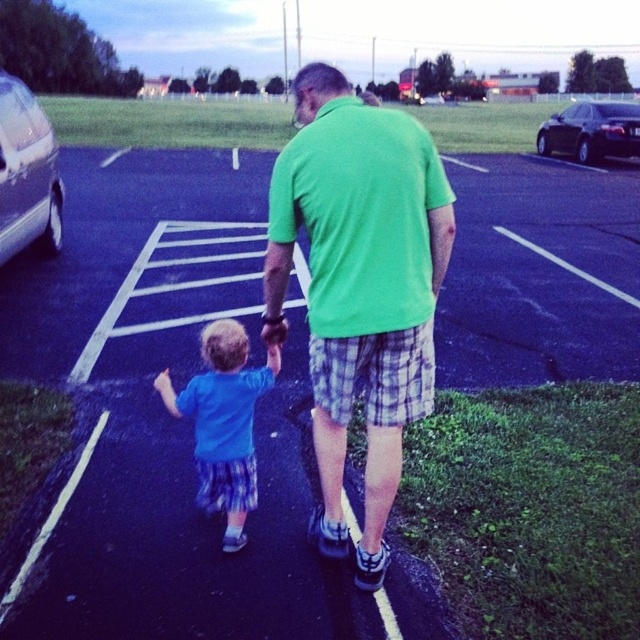
Does green fabric shirt at center have a smaller size compared to shiny black sedan at upper right?

Yes.

Is green fabric shirt at center to the right of shiny black sedan at upper right from the viewer's perspective?

Incorrect, green fabric shirt at center is not on the right side of shiny black sedan at upper right.

Between point (381, 428) and point (572, 154), which one is positioned in front?

Positioned in front is point (381, 428).

At what (x,y) coordinates should I click in order to perform the action: click on green fabric shirt at center. Please return your answer as a coordinate pair (x, y). The height and width of the screenshot is (640, 640). Looking at the image, I should click on (358, 285).

Does green fabric shirt at center appear on the right side of silver metallic car at left?

Correct, you'll find green fabric shirt at center to the right of silver metallic car at left.

Is green fabric shirt at center above silver metallic car at left?

Actually, green fabric shirt at center is below silver metallic car at left.

Is point (426, 170) closer to viewer compared to point (33, 225)?

Yes, it is.

At what (x,y) coordinates should I click in order to perform the action: click on green fabric shirt at center. Please return your answer as a coordinate pair (x, y). Image resolution: width=640 pixels, height=640 pixels. Looking at the image, I should click on (358, 285).

Does blue cotton shirt at center appear on the right side of shiny black sedan at upper right?

Incorrect, blue cotton shirt at center is not on the right side of shiny black sedan at upper right.

The width and height of the screenshot is (640, 640). I want to click on blue cotton shirt at center, so click(x=224, y=422).